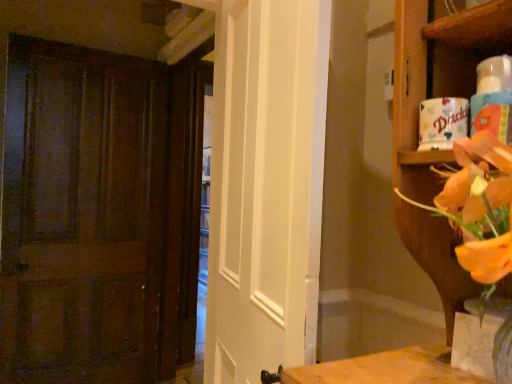
Question: Visually, is wooden door at left positioned to the left or to the right of wooden shelf at upper right?

Choices:
 (A) left
 (B) right

Answer: (A)

Question: From the image's perspective, relative to wooden shelf at upper right, is wooden door at left above or below?

Choices:
 (A) above
 (B) below

Answer: (B)

Question: Which object is positioned closest to the wooden shelf at upper right?

Choices:
 (A) translucent glass vase at lower right
 (B) white glossy door at center
 (C) wooden door at left

Answer: (A)

Question: Which object is the closest to the white glossy door at center?

Choices:
 (A) translucent glass vase at lower right
 (B) wooden shelf at upper right
 (C) wooden door at left

Answer: (B)